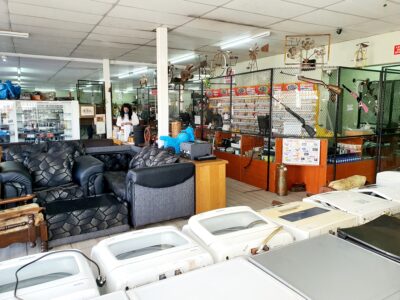
I want to click on washing machines, so click(x=49, y=290), click(x=120, y=272), click(x=241, y=237), click(x=311, y=221), click(x=365, y=201).